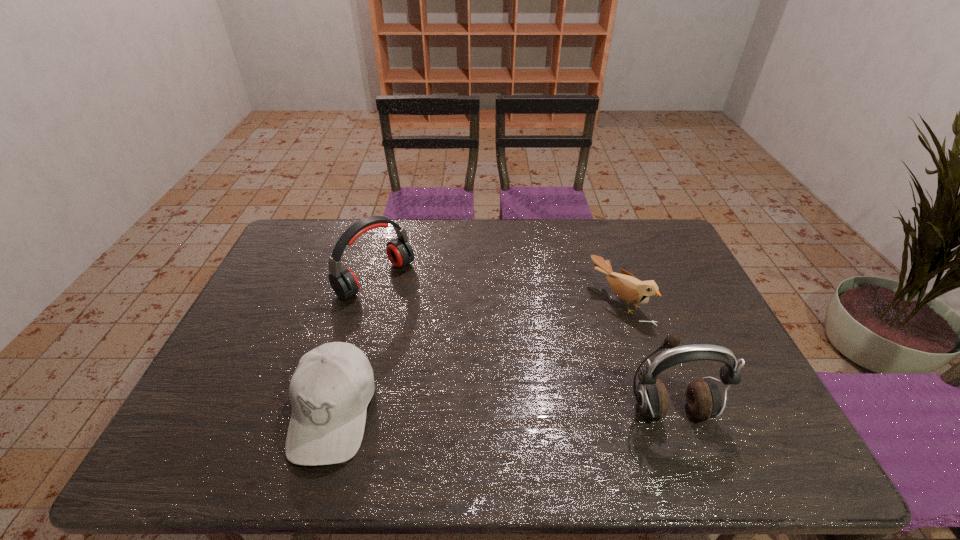
Find the location of `free location located 0.300m on the ear cups of the shorter earphone`. free location located 0.300m on the ear cups of the shorter earphone is located at coordinates (468, 351).

The height and width of the screenshot is (540, 960). I want to click on vacant space located 0.150m on the ear cups of the shorter earphone, so pos(431,323).

Locate an element on the screen. This screenshot has width=960, height=540. object located in the far edge section of the desktop is located at coordinates (343, 281).

Where is `baseball cap that is at the near edge`? The image size is (960, 540). baseball cap that is at the near edge is located at coordinates (330, 390).

This screenshot has width=960, height=540. In order to click on earphone located in the near edge section of the desktop in this screenshot , I will do `click(703, 397)`.

This screenshot has width=960, height=540. Identify the location of object at the right edge. (703, 397).

Locate an element on the screen. This screenshot has width=960, height=540. object positioned at the near right corner is located at coordinates (703, 397).

The image size is (960, 540). In order to click on free space at the far edge in this screenshot , I will do `click(521, 222)`.

I want to click on vacant space at the near edge of the desktop, so (606, 395).

Locate an element on the screen. The height and width of the screenshot is (540, 960). free space at the left edge is located at coordinates (294, 305).